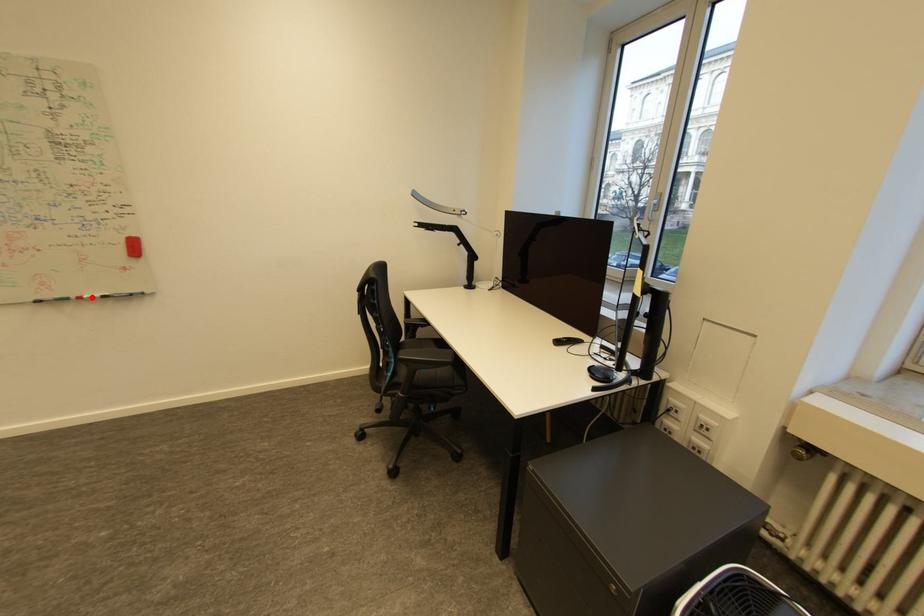
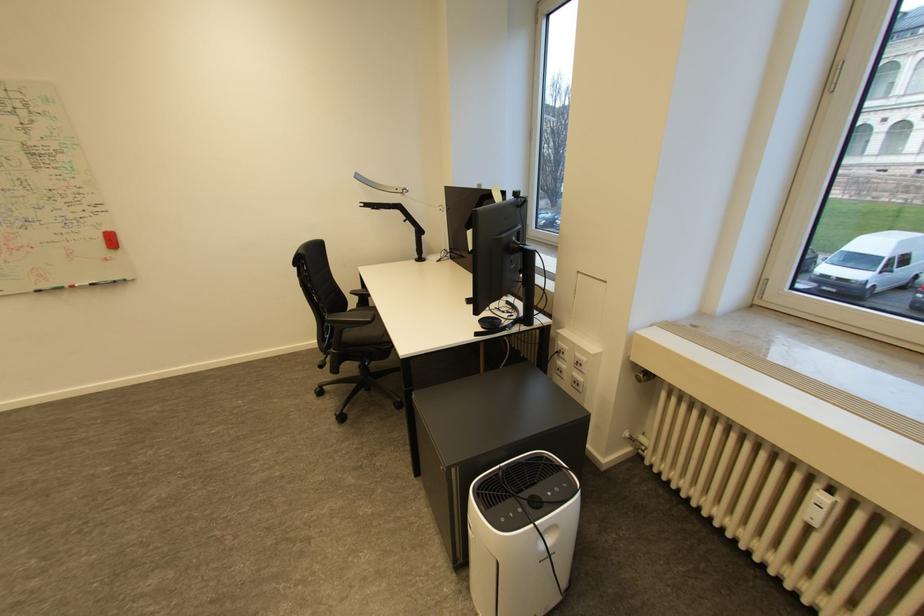
Find the pixel in the second image that matches the highlighted location in the first image.

(83, 286)